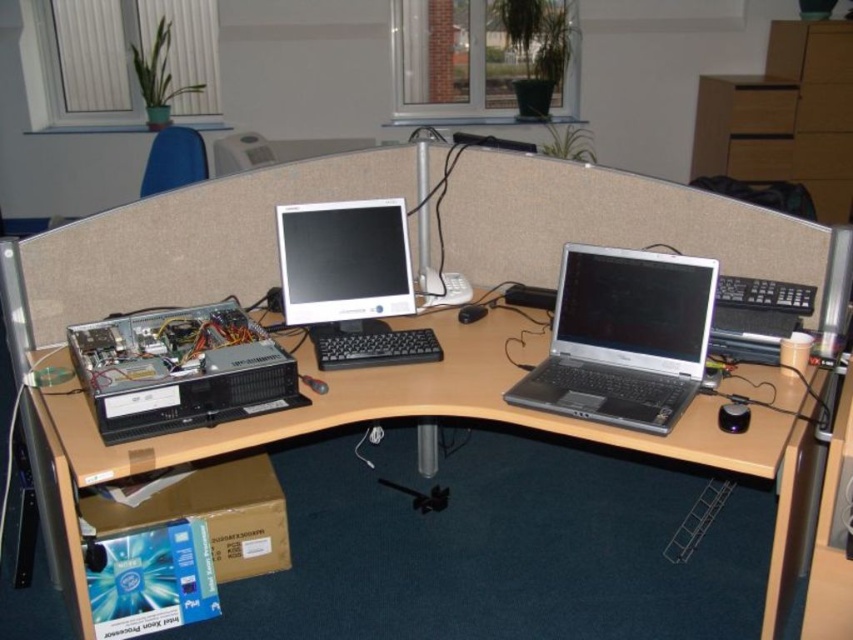
Is wooden at center below black plastic desktop computer at lower left?

Indeed, wooden at center is positioned under black plastic desktop computer at lower left.

Can you confirm if wooden at center is shorter than black plastic desktop computer at lower left?

No.

Where is `wooden at center`? The height and width of the screenshot is (640, 853). wooden at center is located at coordinates (601, 436).

Locate an element on the screen. wooden at center is located at coordinates (601, 436).

Can you confirm if satin black monitor at center is smaller than black plastic mouse at center?

Actually, satin black monitor at center might be larger than black plastic mouse at center.

Can you confirm if satin black monitor at center is shorter than black plastic mouse at center?

No.

Is point (374, 285) less distant than point (473, 307)?

Yes, it is.

Find the location of a particular element. This screenshot has height=640, width=853. satin black monitor at center is located at coordinates (344, 260).

Between black plastic keyboard at center and black plastic mouse at center, which one appears on the right side from the viewer's perspective?

Positioned to the right is black plastic mouse at center.

The image size is (853, 640). What do you see at coordinates (372, 346) in the screenshot?
I see `black plastic keyboard at center` at bounding box center [372, 346].

Does point (426, 330) lie in front of point (465, 321)?

Yes, point (426, 330) is in front of point (465, 321).

Where is `black plastic keyboard at center`? This screenshot has height=640, width=853. black plastic keyboard at center is located at coordinates (372, 346).